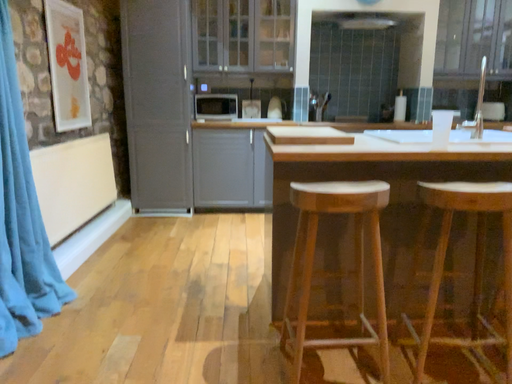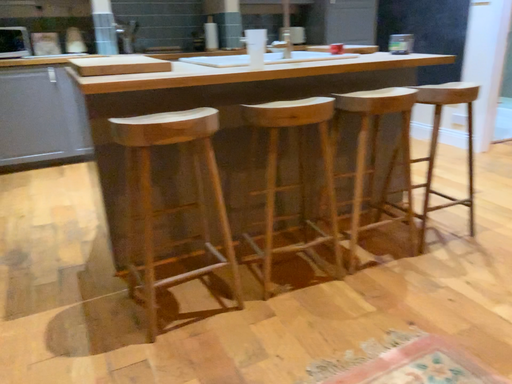
Question: Which way did the camera rotate in the video?

Choices:
 (A) rotated upward
 (B) rotated downward

Answer: (B)